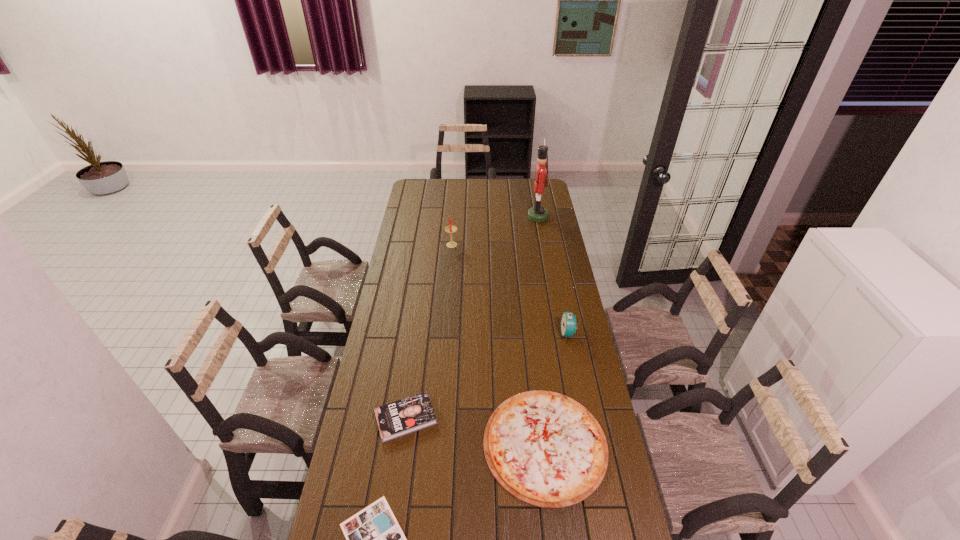
What are the coordinates of `the fourth closest object to the shortest object` in the screenshot? It's located at (450, 229).

The width and height of the screenshot is (960, 540). Find the location of `object identified as the closest to the third shortest object`. object identified as the closest to the third shortest object is located at coordinates (x=544, y=448).